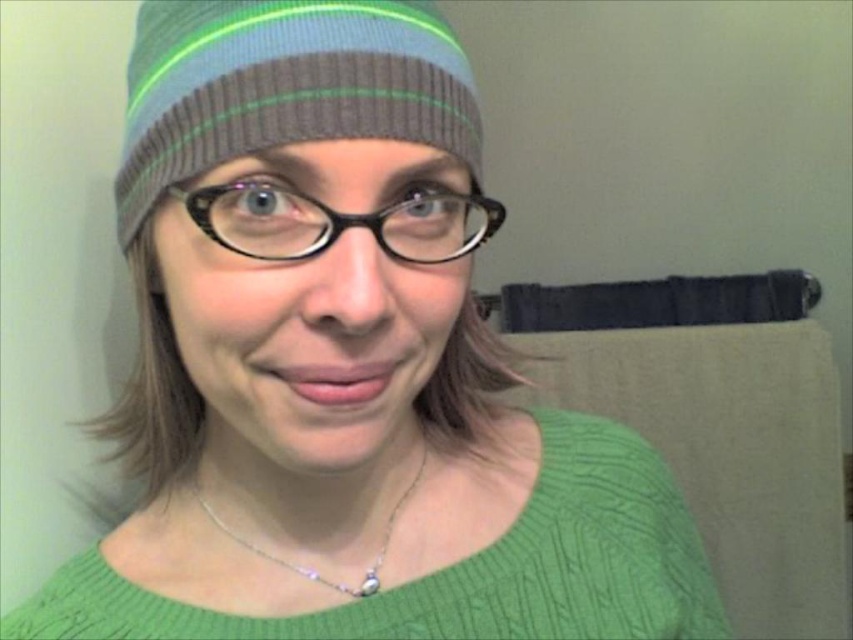
Question: Can you confirm if striped knit beanie at upper center is positioned above silver/glass necklace at center?

Choices:
 (A) no
 (B) yes

Answer: (B)

Question: Which point appears closest to the camera in this image?

Choices:
 (A) (131, 154)
 (B) (373, 579)

Answer: (A)

Question: Among these objects, which one is nearest to the camera?

Choices:
 (A) striped knit beanie at upper center
 (B) silver/glass necklace at center

Answer: (A)

Question: Does striped knit beanie at upper center appear under silver/glass necklace at center?

Choices:
 (A) yes
 (B) no

Answer: (B)

Question: Can you confirm if striped knit beanie at upper center is positioned above silver/glass necklace at center?

Choices:
 (A) no
 (B) yes

Answer: (B)